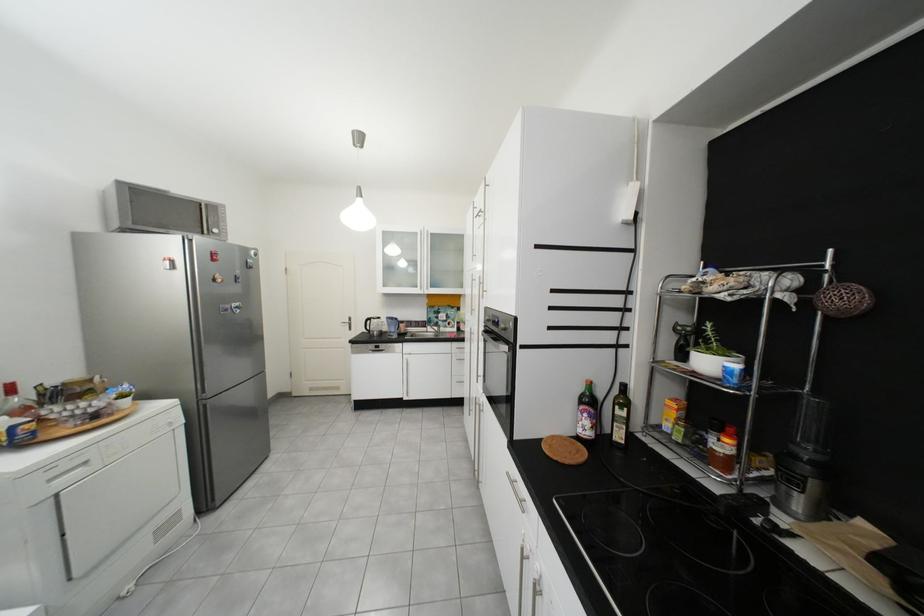
Identify the location of dark glass bottle. (619, 416).